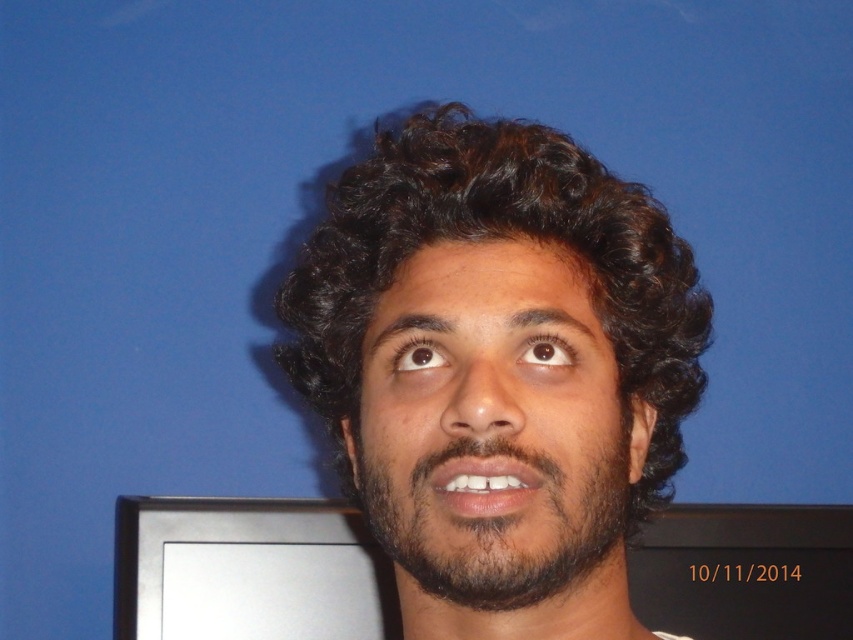
Looking at the person in the image, which object is positioned to the right of the other between the dark brown curly hair at center and the dark brown fuzzy beard at center?

The dark brown curly hair at center is positioned to the right of the dark brown fuzzy beard at center.

You are a photographer adjusting the focus on your camera. You want to ensure that both the dark brown curly hair at center and the dark brown fuzzy beard at center are in focus. Given that your camera has a depth of field that can cover 5 centimeters, will both areas be in focus?

The distance between the dark brown curly hair at center and the dark brown fuzzy beard at center is 4.02 centimeters, which is within the camera sensor depth of field of 5 centimeters. Therefore, both areas will be in focus.